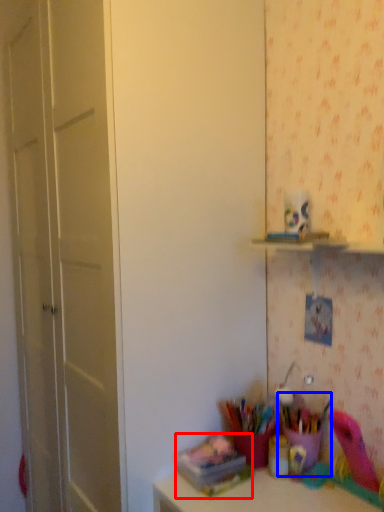
Question: Which object is closer to the camera taking this photo, stationery (highlighted by a red box) or stationery (highlighted by a blue box)?

Choices:
 (A) stationery
 (B) stationery

Answer: (A)